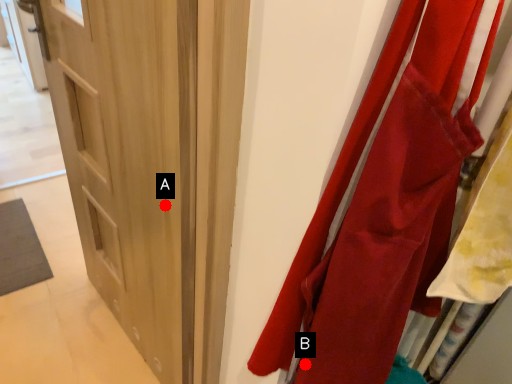
Question: Two points are circled on the image, labeled by A and B beside each circle. Which point appears farthest from the camera in this image?

Choices:
 (A) A is further
 (B) B is further

Answer: (A)